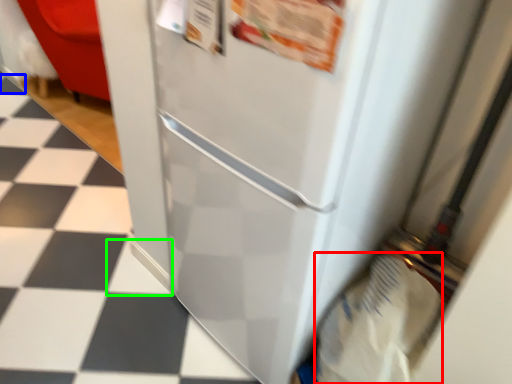
Question: Which object is positioned closest to grocery bag (highlighted by a red box)? Select from tile (highlighted by a blue box) and tile (highlighted by a green box).

Choices:
 (A) tile
 (B) tile

Answer: (B)